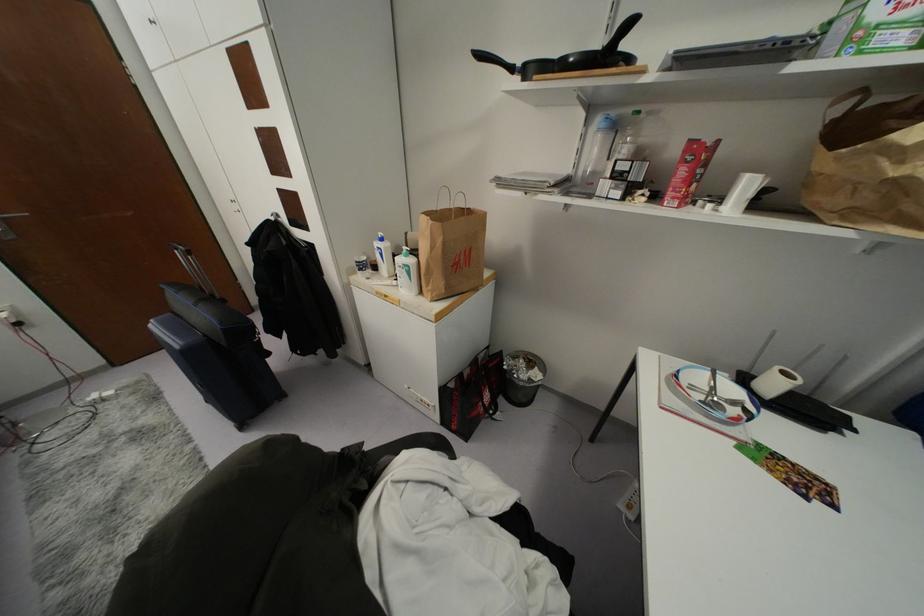
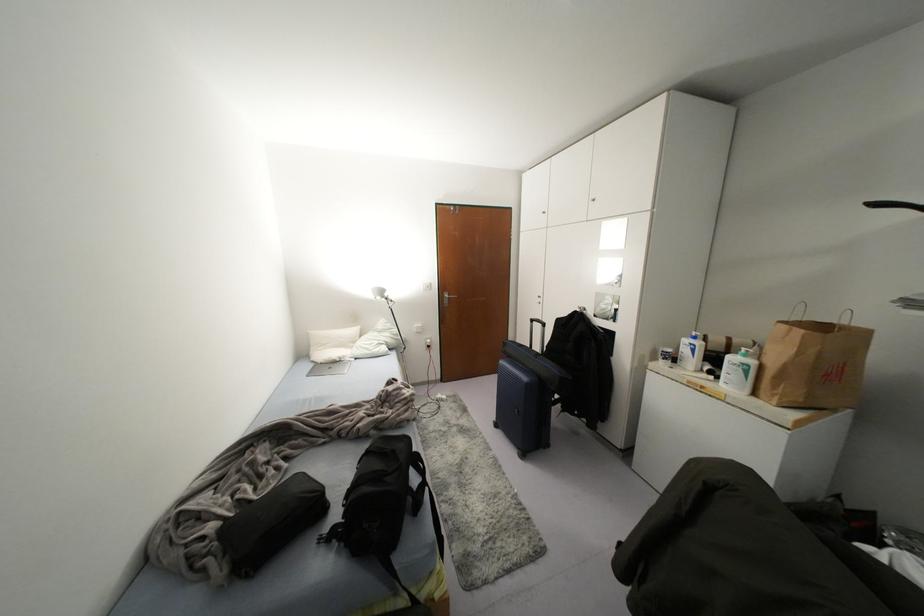
Where in the second image is the point corresponding to (x=381, y=254) from the first image?

(691, 350)